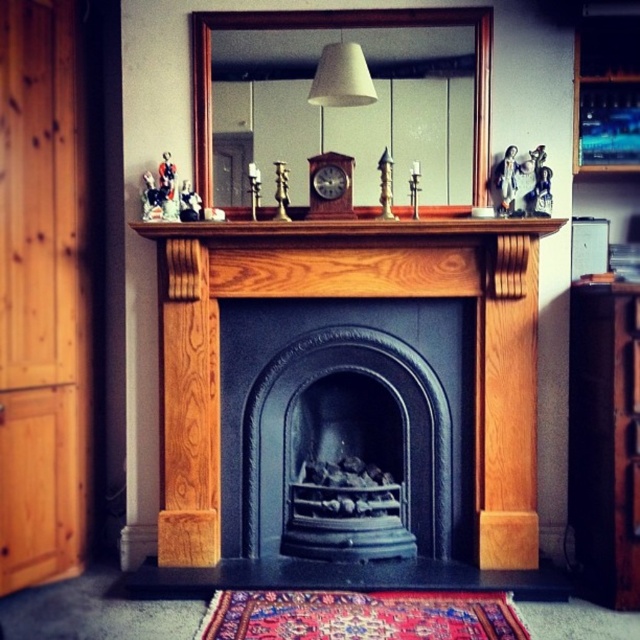
Who is taller, wooden fireplace at center or wooden mantelpiece at center?

Standing taller between the two is wooden fireplace at center.

Which is above, wooden fireplace at center or wooden mantelpiece at center?

wooden mantelpiece at center

Between point (262, 506) and point (179, 230), which one is positioned behind?

Positioned behind is point (262, 506).

You are a GUI agent. You are given a task and a screenshot of the screen. Output one action in this format:
    pyautogui.click(x=<x>, y=<y>)
    Task: Click on the wooden fireplace at center
    
    Given the screenshot: What is the action you would take?
    pyautogui.click(x=348, y=401)

Does wooden fireplace at center have a lesser width compared to wooden cabinet at right?

In fact, wooden fireplace at center might be wider than wooden cabinet at right.

Is wooden fireplace at center below wooden cabinet at right?

No, wooden fireplace at center is not below wooden cabinet at right.

Is point (404, 422) behind point (580, 353)?

Yes.

Identify the location of wooden fireplace at center. (348, 401).

Which is more to the right, wooden fireplace at center or wooden armoire at left?

Positioned to the right is wooden fireplace at center.

Can you confirm if wooden fireplace at center is taller than wooden armoire at left?

In fact, wooden fireplace at center may be shorter than wooden armoire at left.

Between point (304, 566) and point (6, 564), which one is positioned in front?

Point (6, 564) is more forward.

Find the location of a particular element. Image resolution: width=640 pixels, height=640 pixels. wooden fireplace at center is located at coordinates (348, 401).